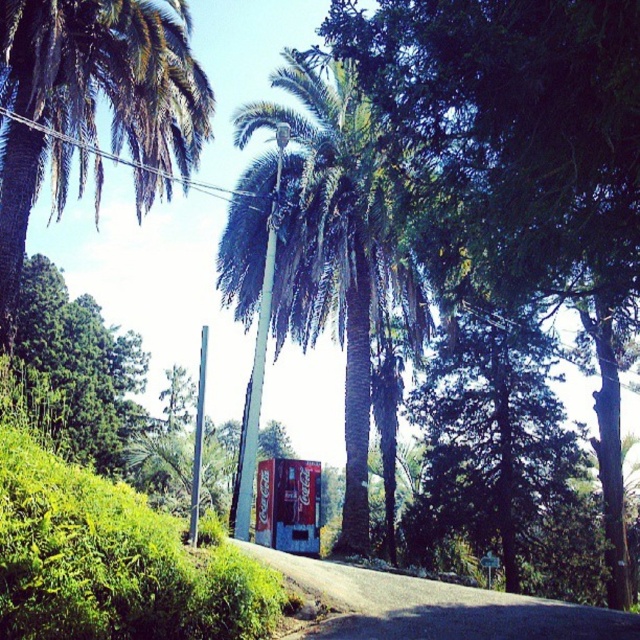
You are a hiker standing on the paved road and want to take a photo of the green leafy palm tree at center and the green leafy palm tree at upper left. Which tree will appear smaller in your photo?

The green leafy palm tree at center will appear smaller in your photo because it is positioned under the green leafy palm tree at upper left, meaning it is further away from the camera.

You are standing at the point labeled point (x=65, y=49) and want to walk to the point labeled point (x=388, y=275). Given the scene described, will the path between these two points be obstructed by any of the objects in the scene?

The path between point (x=65, y=49) and point (x=388, y=275) is not obstructed by any objects in the scene because the point (x=388, y=275) is behind point (x=65, y=49), meaning it is further away and the objects mentioned in the scene description do not block the line of sight between them.